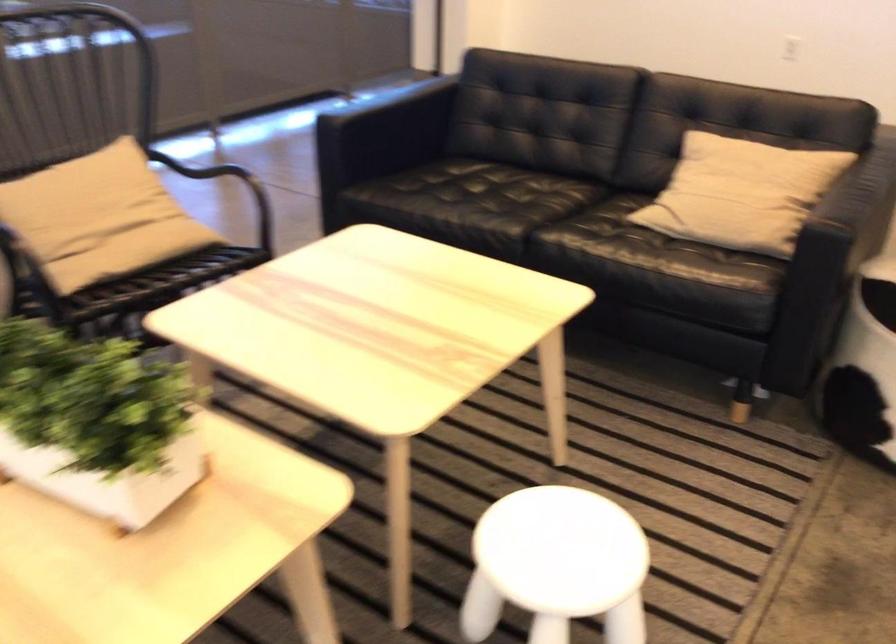
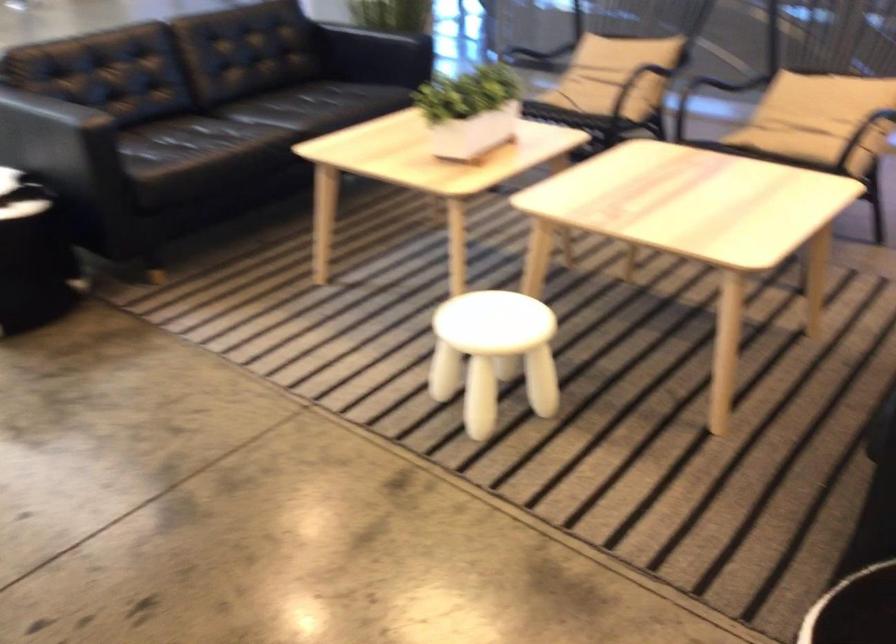
Locate, in the second image, the point that corresponds to pixel 158 223 in the first image.

(817, 118)